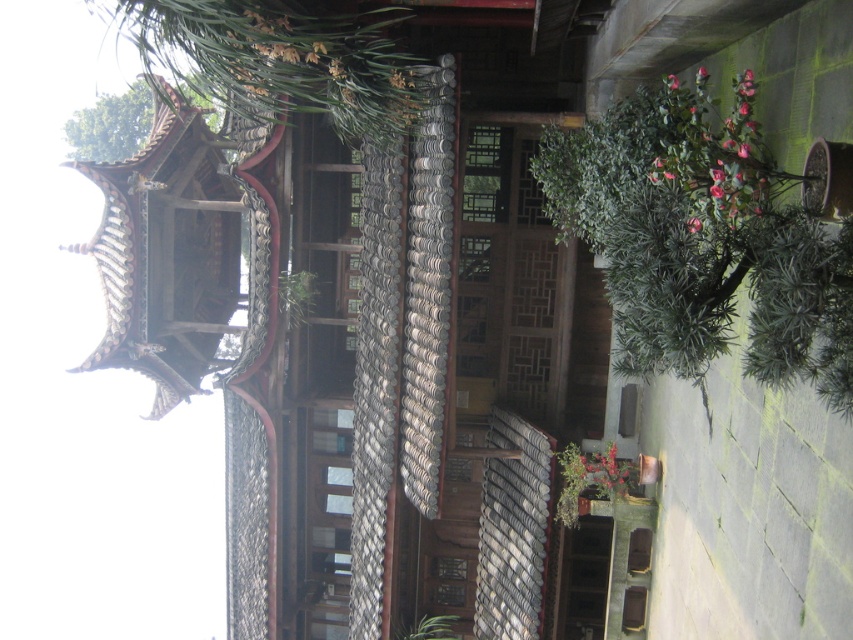
Question: Which of the following is the closest to the observer?

Choices:
 (A) (308, 36)
 (B) (300, 289)
 (C) (448, 616)
 (D) (564, 465)

Answer: (A)

Question: Is green matte plant at lower center further to camera compared to green leafy plant at center?

Choices:
 (A) no
 (B) yes

Answer: (A)

Question: Which object is positioned farthest from the green leafy plant at center?

Choices:
 (A) green leafy plant at right
 (B) green leafy plant at upper left
 (C) green matte plant at lower center

Answer: (A)

Question: Can you confirm if green leafy plant at right is smaller than green matte plant at lower center?

Choices:
 (A) yes
 (B) no

Answer: (B)

Question: Among these objects, which one is nearest to the camera?

Choices:
 (A) green leafy plant at lower center
 (B) green leafy plant at upper left
 (C) green matte plant at lower center
 (D) green leafy plant at center

Answer: (B)

Question: Is green leafy plant at right below green leafy plant at upper left?

Choices:
 (A) yes
 (B) no

Answer: (A)